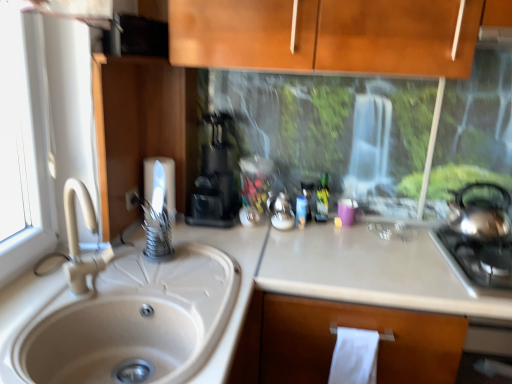
This screenshot has width=512, height=384. What are the coordinates of `vacant area that is in front of green matte bottle at center` in the screenshot? It's located at pos(327,237).